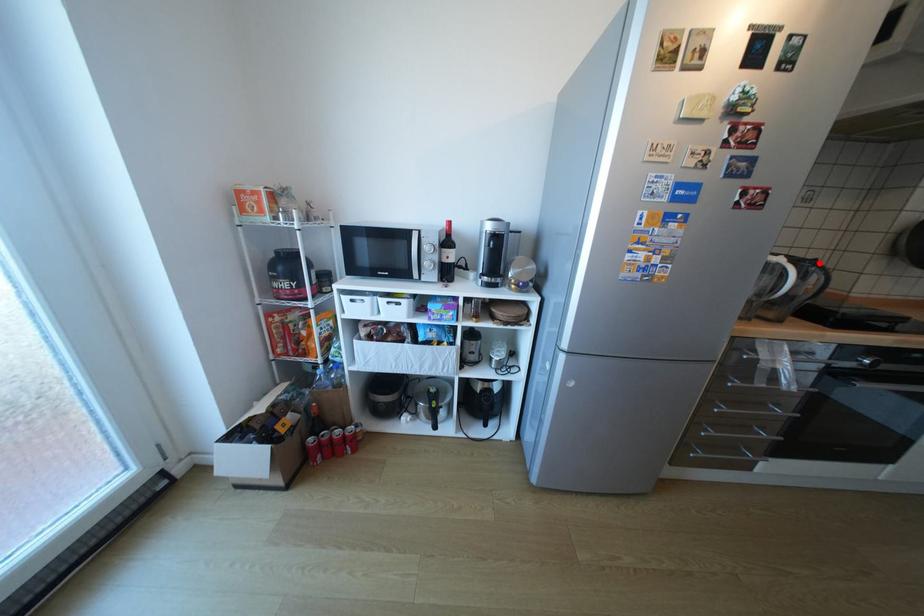
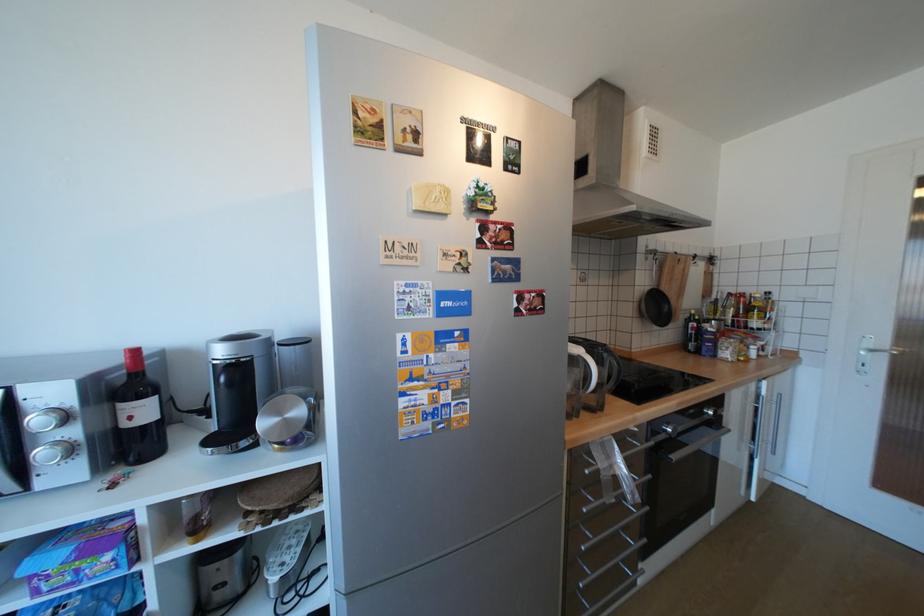
Locate, in the second image, the point that corresponds to the highlighted location in the first image.

(612, 350)